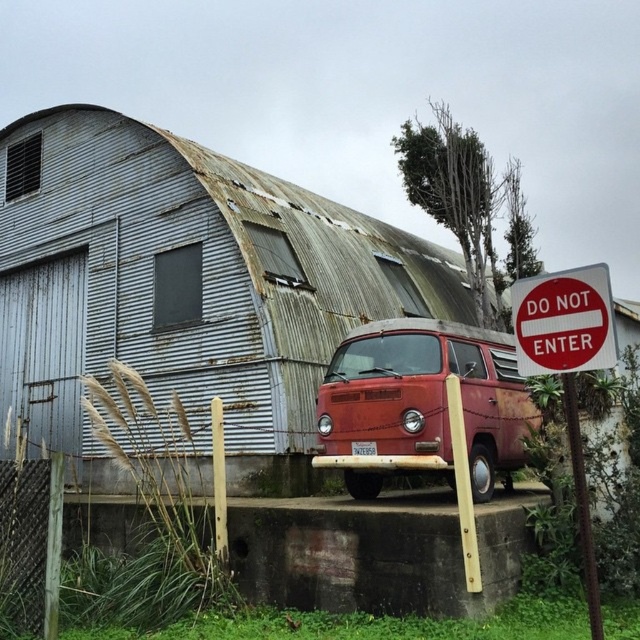
Which is above, rusty corrugated metal barn at center or red plastic sign at upper right?

Positioned higher is rusty corrugated metal barn at center.

Does rusty corrugated metal barn at center appear under red plastic sign at upper right?

No, rusty corrugated metal barn at center is not below red plastic sign at upper right.

The width and height of the screenshot is (640, 640). Find the location of `rusty corrugated metal barn at center`. rusty corrugated metal barn at center is located at coordinates (188, 280).

Which of these two, rusty metal van at center or red plastic sign at right, stands taller?

Standing taller between the two is rusty metal van at center.

Which is behind, point (353, 340) or point (515, 346)?

Positioned behind is point (353, 340).

Locate an element on the screen. rusty metal van at center is located at coordinates (420, 404).

Can you confirm if rusty corrugated metal barn at center is smaller than rusty metal van at center?

Actually, rusty corrugated metal barn at center might be larger than rusty metal van at center.

Who is more distant from viewer, (141,163) or (419,412)?

Positioned behind is point (141,163).

Locate an element on the screen. This screenshot has width=640, height=640. rusty corrugated metal barn at center is located at coordinates (188, 280).